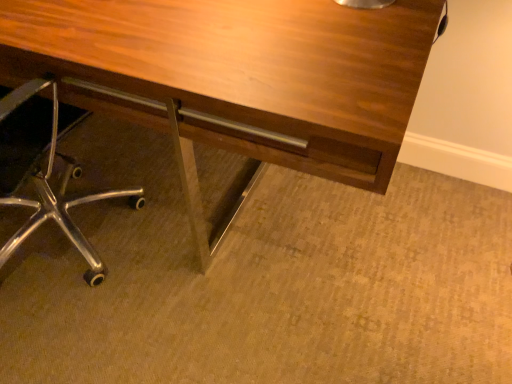
The height and width of the screenshot is (384, 512). What are the coordinates of `empty space that is in between metal/chrome chair at lower left and wooden desk at center` in the screenshot? It's located at (180, 297).